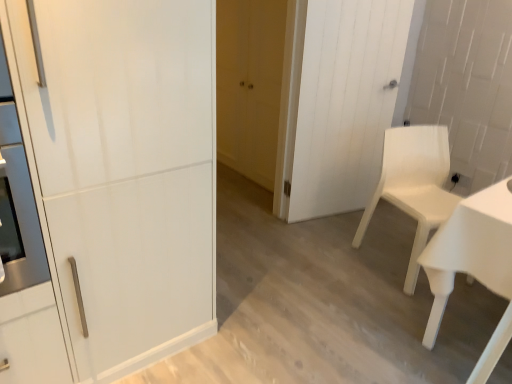
The width and height of the screenshot is (512, 384). I want to click on space that is in front of white wood door at center, the second door when ordered from back to front, so click(x=326, y=252).